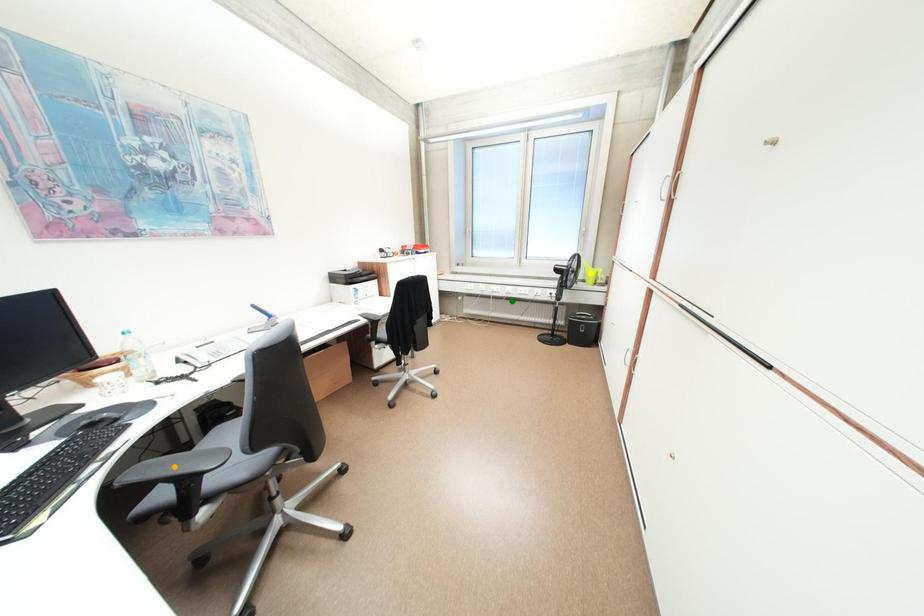
Order these from nearest to farthest:
green point, yellow point, orange point

green point → yellow point → orange point